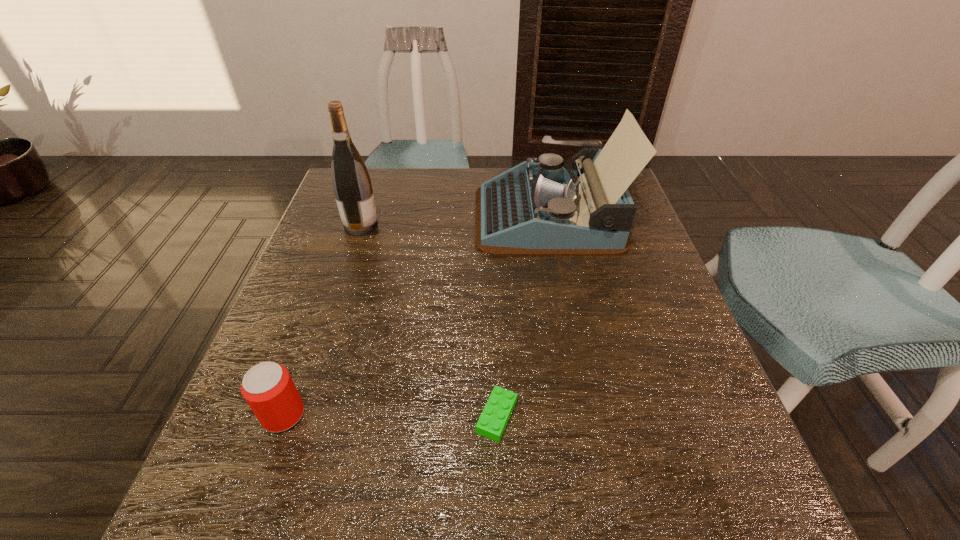
Identify the location of object situated at the far edge. The width and height of the screenshot is (960, 540). (534, 209).

Find the location of `wine bottle situated at the left edge`. wine bottle situated at the left edge is located at coordinates (351, 183).

The width and height of the screenshot is (960, 540). I want to click on beer can present at the left edge, so click(x=268, y=388).

Locate an element on the screen. This screenshot has width=960, height=540. object that is positioned at the right edge is located at coordinates (534, 209).

Where is `object present at the far right corner`? Image resolution: width=960 pixels, height=540 pixels. object present at the far right corner is located at coordinates (534, 209).

Identify the location of free space at the far edge. This screenshot has height=540, width=960. (428, 206).

The width and height of the screenshot is (960, 540). Find the location of `free space at the near edge of the desktop`. free space at the near edge of the desktop is located at coordinates (319, 527).

You are a GUI agent. You are given a task and a screenshot of the screen. Output one action in this format:
    pyautogui.click(x=<x>, y=<y>)
    Task: Click on the free point at the left edge
    
    Given the screenshot: What is the action you would take?
    pyautogui.click(x=316, y=256)

Where is `vacant area at the right edge`? This screenshot has width=960, height=540. vacant area at the right edge is located at coordinates (630, 318).

Locate an element on the screen. free spot at the far left corner of the desktop is located at coordinates (389, 172).